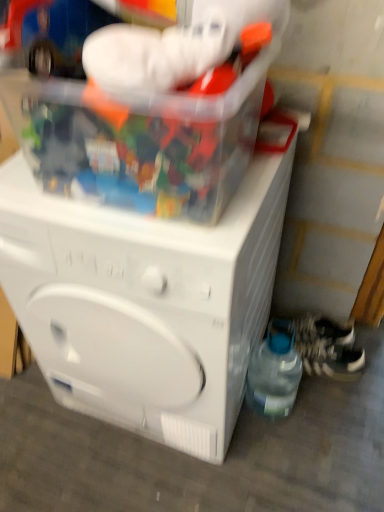
At what (x,y) coordinates should I click in order to perform the action: click on vacant area located to the right-hand side of transparent plastic bottle at lower right. Please return your answer as a coordinate pair (x, y). Image resolution: width=384 pixels, height=512 pixels. Looking at the image, I should click on (322, 408).